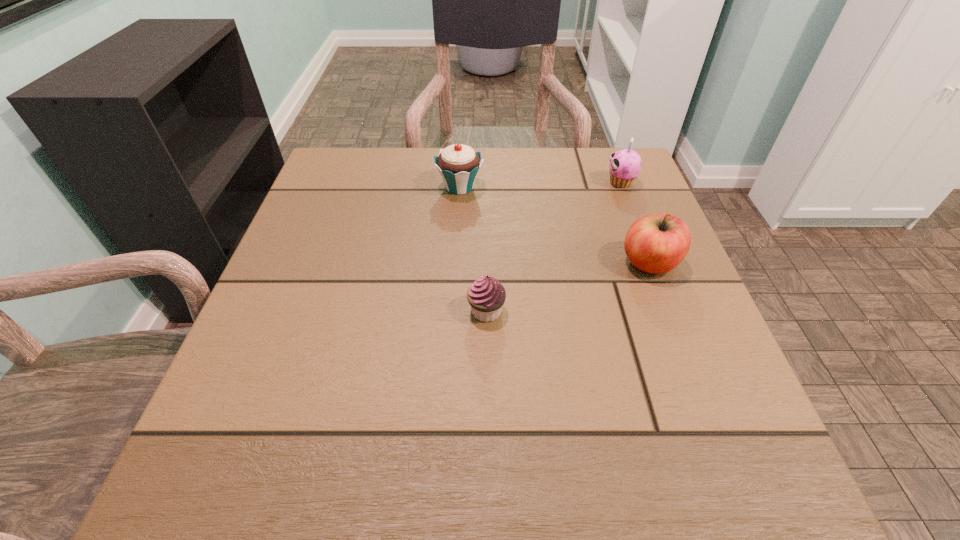
In order to click on free space between the shortest cupcake and the rightmost cupcake in this screenshot , I will do `click(554, 247)`.

You are a GUI agent. You are given a task and a screenshot of the screen. Output one action in this format:
    pyautogui.click(x=<x>, y=<y>)
    Task: Click on the free space between the nearest cupcake and the second nearest object
    
    Given the screenshot: What is the action you would take?
    pyautogui.click(x=567, y=287)

Image resolution: width=960 pixels, height=540 pixels. Find the location of `free space between the nearest object and the rightmost cupcake`. free space between the nearest object and the rightmost cupcake is located at coordinates (554, 247).

Where is `free space between the nearest object and the rightmost cupcake`? Image resolution: width=960 pixels, height=540 pixels. free space between the nearest object and the rightmost cupcake is located at coordinates (554, 247).

Locate an element on the screen. This screenshot has height=540, width=960. object that is the third closest to the rightmost cupcake is located at coordinates (486, 296).

Choose which object is the third nearest neighbor to the rightmost cupcake. Please provide its 2D coordinates. Your answer should be formatted as a tuple, i.e. [(x, y)], where the tuple contains the x and y coordinates of a point satisfying the conditions above.

[(486, 296)]

Select which cupcake is the closest to the second nearest object. Please provide its 2D coordinates. Your answer should be formatted as a tuple, i.e. [(x, y)], where the tuple contains the x and y coordinates of a point satisfying the conditions above.

[(625, 165)]

Identify which cupcake is located as the nearest to the nearest cupcake. Please provide its 2D coordinates. Your answer should be formatted as a tuple, i.e. [(x, y)], where the tuple contains the x and y coordinates of a point satisfying the conditions above.

[(458, 164)]

Identify the location of vacant space that satisfies the following two spatial constraints: 1. on the face of the rightmost cupcake; 2. on the front side of the nearest cupcake. The image size is (960, 540). (671, 311).

The height and width of the screenshot is (540, 960). I want to click on free space that satisfies the following two spatial constraints: 1. on the face of the rightmost cupcake; 2. on the front side of the apple, so click(x=652, y=263).